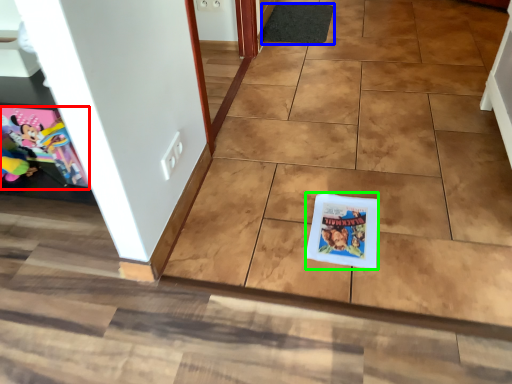
Question: Estimate the real-world distances between objects in this image. Which object is closer to comic book (highlighted by a red box), doormat (highlighted by a blue box) or comic book (highlighted by a green box)?

Choices:
 (A) doormat
 (B) comic book

Answer: (B)